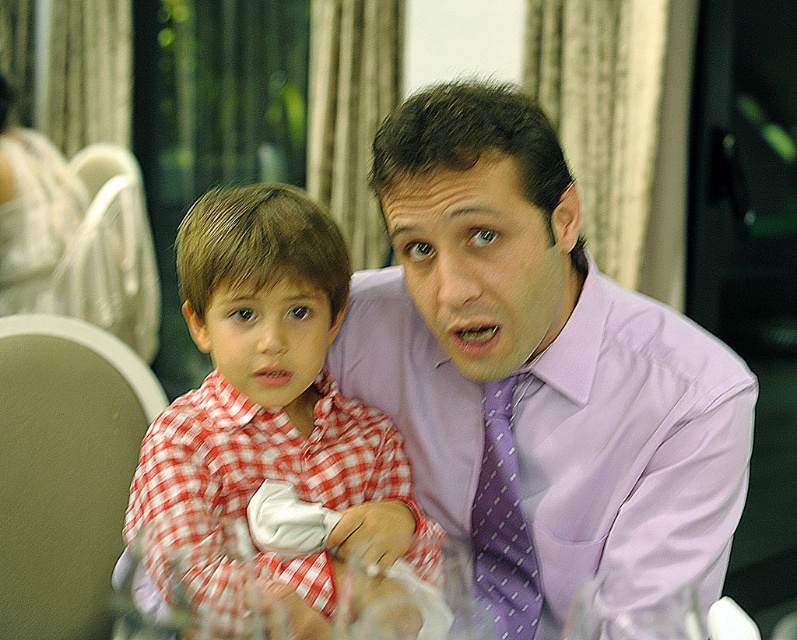
You are organizing a closet and need to place the purple satin dress shirt at center and the red checkered shirt at center on the same hanger. Which shirt should you choose to ensure they both fit on the hanger without overlapping?

The red checkered shirt at center should be placed on the hanger first since the purple satin dress shirt at center might be wider and could overlap if placed second.

You are standing at the center of the image and want to move towards the two points labeled point (222,577) and point (540,598). Which point should you reach first if you move straight ahead?

Point (222,577) is in front of point (540,598), so you should reach point (222,577) first.

You are organizing a charity event and need to ensure that all donated clothing items fit properly. You have a purple satin dress shirt at center and a purple dotted tie at center. Which item requires more space when packing them separately?

The purple satin dress shirt at center requires more space when packing because it has a larger size compared to the purple dotted tie at center.